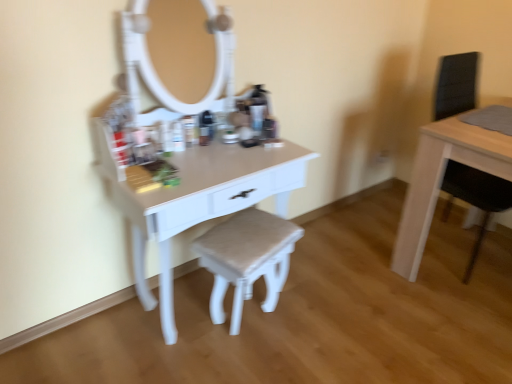
Find the location of a particular element. free space to the left of matte white stool at center is located at coordinates (183, 329).